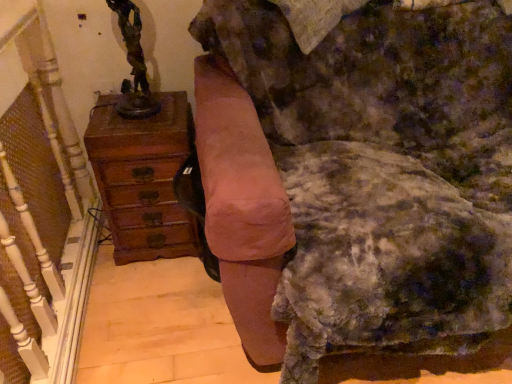
Question: Is wooden chest of drawers at left wider or thinner than velvet pink armchair at center?

Choices:
 (A) thin
 (B) wide

Answer: (A)

Question: From their relative heights in the image, would you say wooden chest of drawers at left is taller or shorter than velvet pink armchair at center?

Choices:
 (A) tall
 (B) short

Answer: (B)

Question: Which is farther from the bronze statue at upper left?

Choices:
 (A) suede-like pink swivel chair at center
 (B) velvet pink armchair at center
 (C) wooden chest of drawers at left

Answer: (A)

Question: Estimate the real-world distances between objects in this image. Which object is farther from the suede-like pink swivel chair at center?

Choices:
 (A) bronze statue at upper left
 (B) velvet pink armchair at center
 (C) wooden chest of drawers at left

Answer: (A)